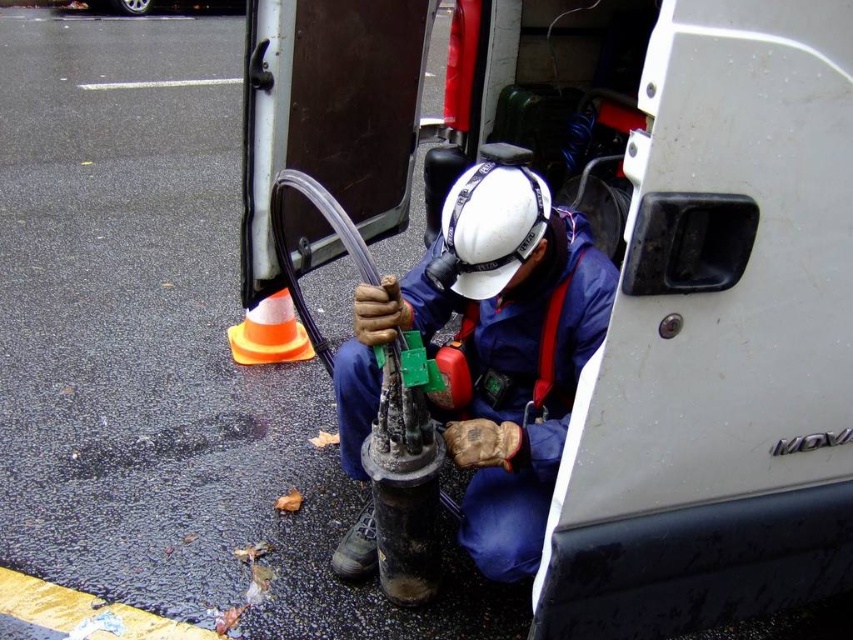
Question: In this image, where is blue fabric construction worker at center located relative to orange reflective plastic traffic cone at lower center?

Choices:
 (A) right
 (B) left

Answer: (A)

Question: Where is blue fabric construction worker at center located in relation to orange reflective plastic traffic cone at lower center in the image?

Choices:
 (A) above
 (B) below

Answer: (B)

Question: Does blue fabric construction worker at center appear on the left side of orange reflective plastic traffic cone at lower center?

Choices:
 (A) yes
 (B) no

Answer: (B)

Question: Which point is closer to the camera?

Choices:
 (A) (367, 342)
 (B) (270, 346)

Answer: (A)

Question: Which point is farther from the camera taking this photo?

Choices:
 (A) (598, 272)
 (B) (260, 304)

Answer: (B)